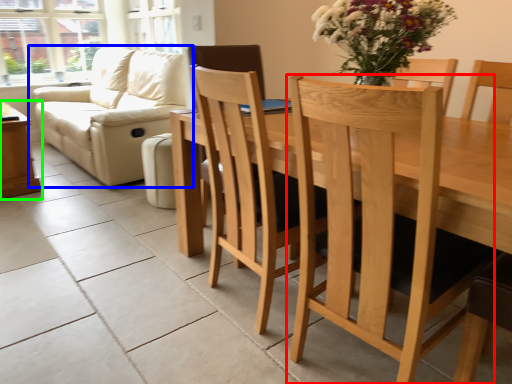
Question: Which object is the farthest from chair (highlighted by a red box)? Choose among these: studio couch (highlighted by a blue box) or table (highlighted by a green box).

Choices:
 (A) studio couch
 (B) table

Answer: (B)